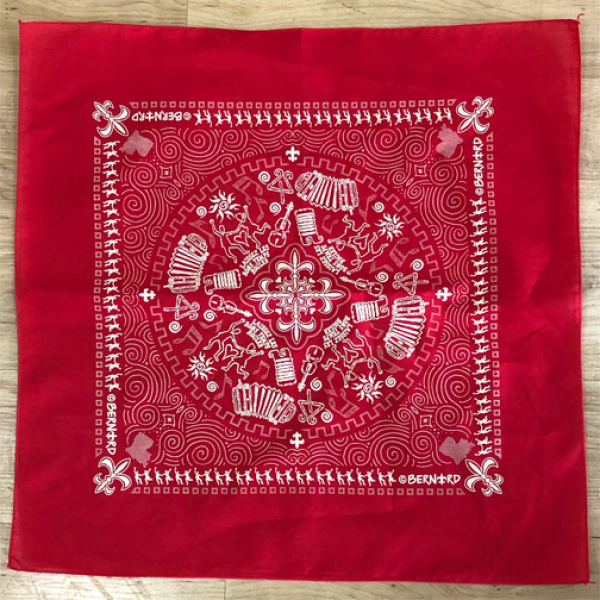
You are a GUI agent. You are given a task and a screenshot of the screen. Output one action in this format:
    pyautogui.click(x=<x>, y=<y>)
    Task: Click on the red cloth
    Image resolution: width=600 pixels, height=600 pixels.
    Given the screenshot: What is the action you would take?
    pyautogui.click(x=75, y=191)